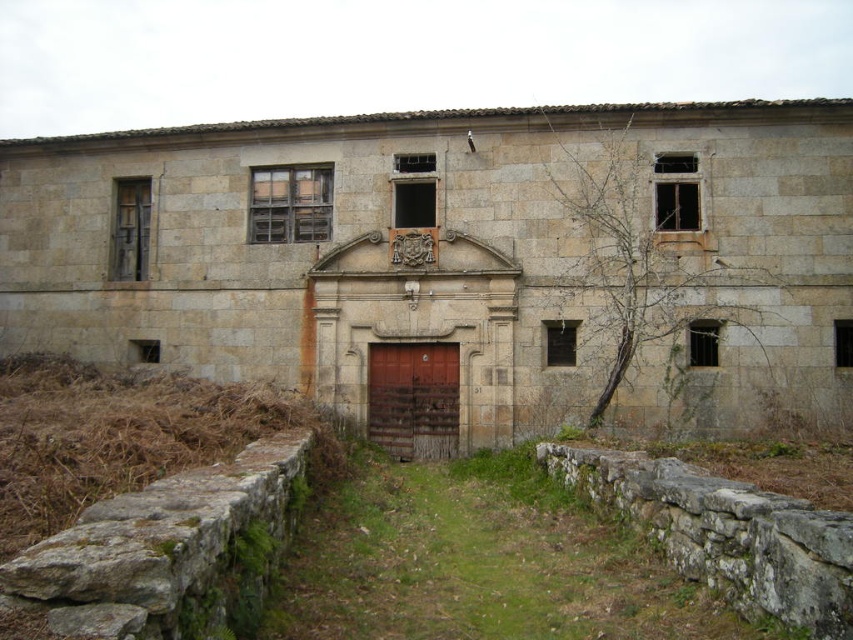
Question: Which object is farther from the camera taking this photo?

Choices:
 (A) brown grassy hay at lower left
 (B) rusty metal door at center

Answer: (B)

Question: Is brown grassy hay at lower left wider than rusty metal door at center?

Choices:
 (A) yes
 (B) no

Answer: (A)

Question: Does brown grassy hay at lower left lie in front of rusty metal door at center?

Choices:
 (A) no
 (B) yes

Answer: (B)

Question: Can you confirm if brown grassy hay at lower left is wider than rusty metal door at center?

Choices:
 (A) yes
 (B) no

Answer: (A)

Question: Which point is closer to the camera taking this photo?

Choices:
 (A) (370, 400)
 (B) (7, 515)

Answer: (B)

Question: Which point is farther to the camera?

Choices:
 (A) (227, 440)
 (B) (403, 412)

Answer: (B)